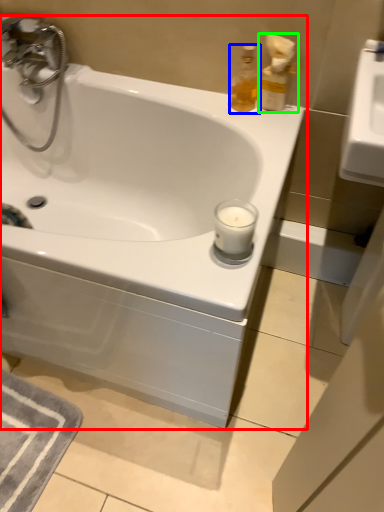
Question: Which object is positioned farthest from bathtub (highlighted by a red box)? Select from soap dispenser (highlighted by a blue box) and soap dispenser (highlighted by a green box).

Choices:
 (A) soap dispenser
 (B) soap dispenser

Answer: (B)